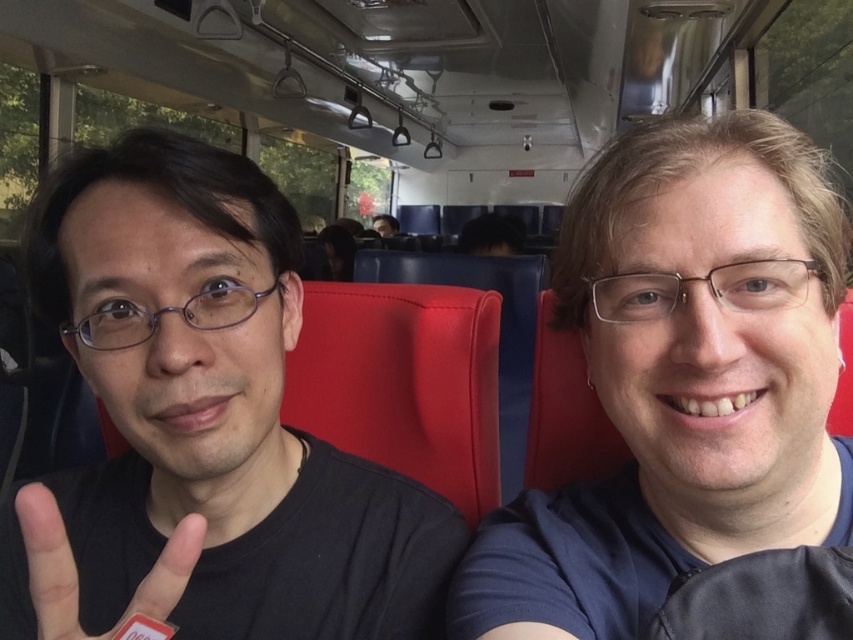
You are a passenger on the bus and see the black matte hand at left near the ceiling. Can you reach it with your hand?

The black matte hand at left is located at point (76, 568), which is near the ceiling. Since most people cannot reach that high, it is unlikely you can reach it with your hand.

You are a passenger on the bus and you want to reach the black matte hand at left to take a photo. Can you comfortably reach it without moving from your seat?

The black matte hand at left is 11.35 inches from the viewer, so yes, you can comfortably reach it without moving from your seat since it is within a typical arm reach distance.

You are a designer trying to create a layout for a magazine cover. You have two elements to place side by side horizontally. The first element is the black matte shirt at left, and the second is the dark brown hair at upper center. Which element should you make wider to maintain visual balance?

The black matte shirt at left is wider than the dark brown hair at upper center, so to maintain visual balance, you should make the dark brown hair at upper center wider to match the width of the black matte shirt at left.